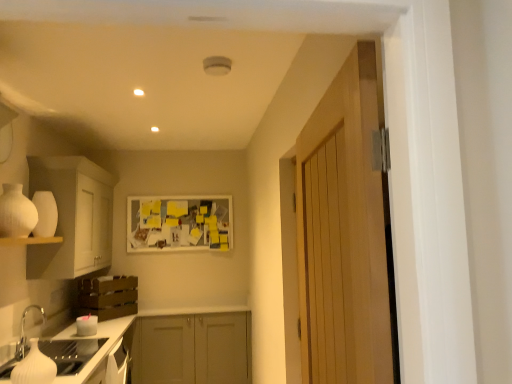
Locate an element on the screen. vacant area on the back side of white glossy sink at lower left is located at coordinates (58, 348).